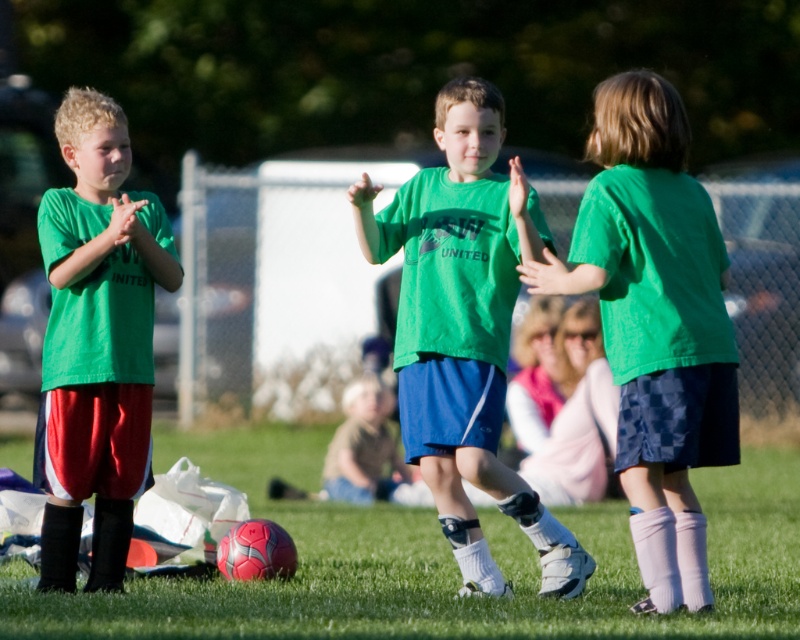
Can you confirm if green grass at lower center is positioned to the right of matte green shirt at left?

Correct, you'll find green grass at lower center to the right of matte green shirt at left.

Which is behind, point (354, 548) or point (40, 452)?

The point (354, 548) is behind.

Image resolution: width=800 pixels, height=640 pixels. What are the coordinates of `green grass at lower center` in the screenshot? It's located at (438, 563).

The width and height of the screenshot is (800, 640). I want to click on green grass at lower center, so click(438, 563).

Does matte green shirt at center appear on the left side of green matte shirt at center?

In fact, matte green shirt at center is to the right of green matte shirt at center.

Which of these two, matte green shirt at center or green matte shirt at center, stands taller?

green matte shirt at center is taller.

Where is `matte green shirt at center`? This screenshot has height=640, width=800. matte green shirt at center is located at coordinates (656, 324).

At what (x,y) coordinates should I click in order to perform the action: click on matte green shirt at center. Please return your answer as a coordinate pair (x, y). The height and width of the screenshot is (640, 800). Looking at the image, I should click on (656, 324).

Does point (554, 625) come in front of point (480, 113)?

Yes, point (554, 625) is closer to viewer.

Who is more forward, (385, 611) or (446, 516)?

Point (385, 611) is in front.

I want to click on green grass at lower center, so click(x=438, y=563).